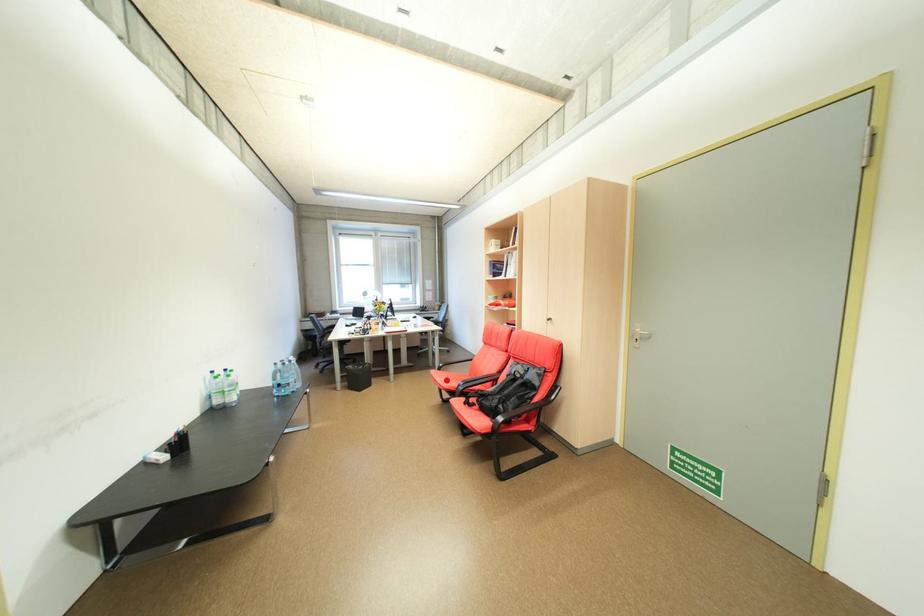
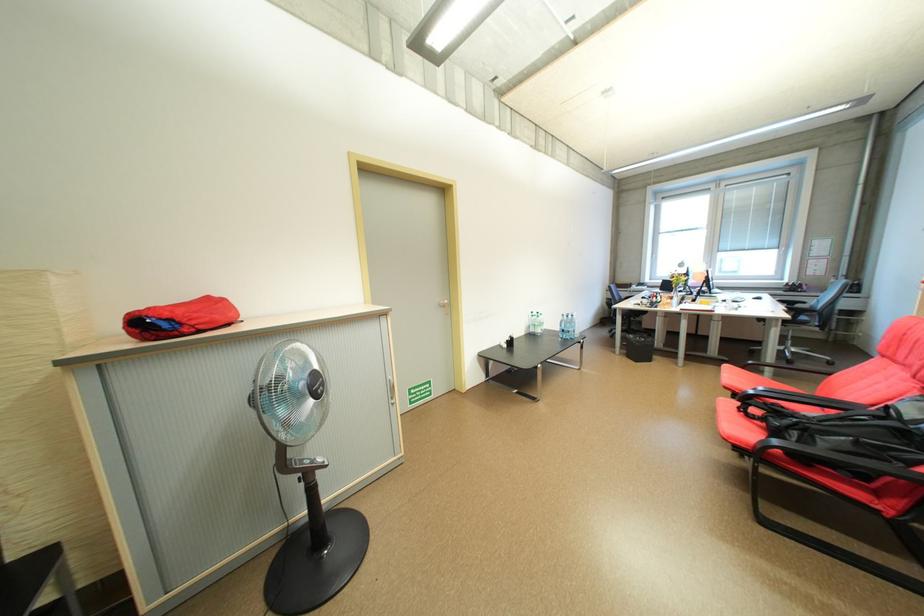
In the second image, find the point that corresponds to the highlighted location in the first image.

(734, 376)